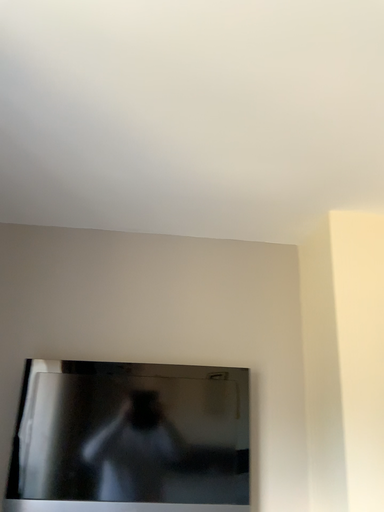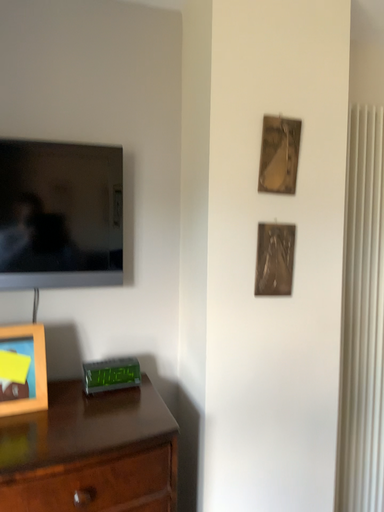
Question: How did the camera likely rotate when shooting the video?

Choices:
 (A) rotated left
 (B) rotated right

Answer: (B)